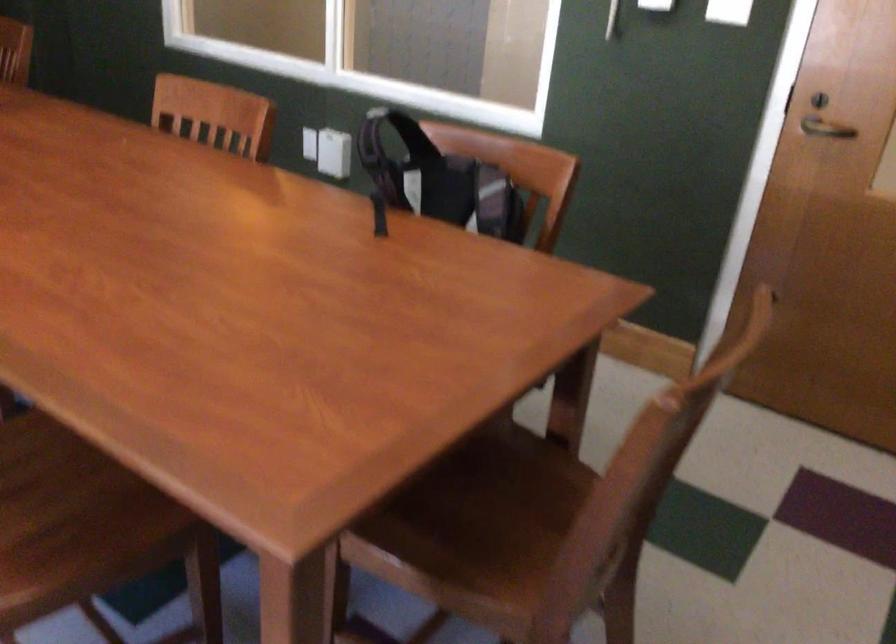
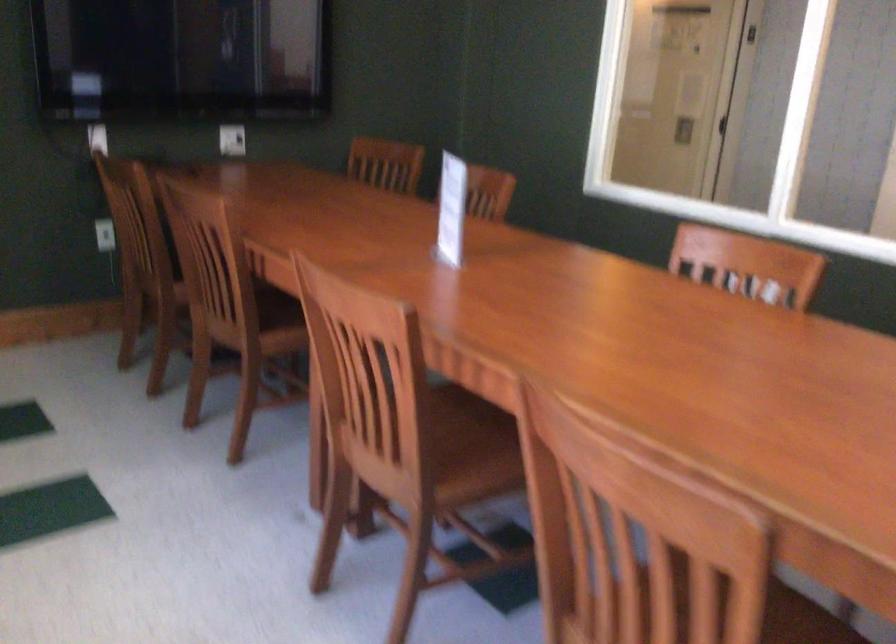
Question: What movement of the cameraman would produce the second image?

Choices:
 (A) Left
 (B) Right
 (C) Forward
 (D) Backward

Answer: (A)